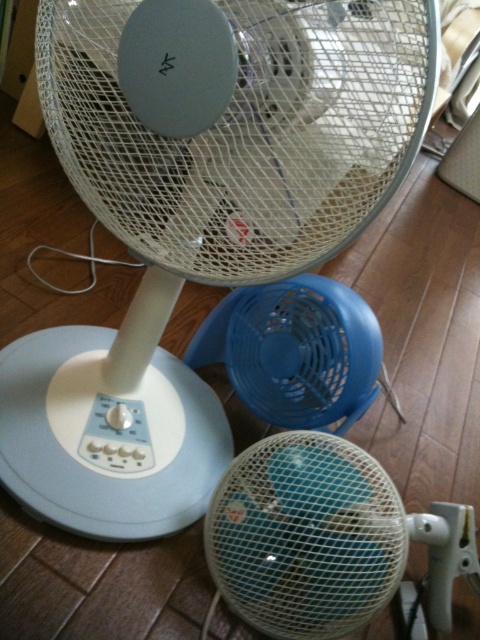
You are standing at the origin point of the coordinate system. You want to move towards the blue mesh fan at center. Which direction should you move in to reach it?

You should move towards the direction of point 0.842 on the x axis and 0.675 on the y axis to reach the blue mesh fan at center.

You are standing in a room with two fans. One is a blue mesh fan at center and the other is a blue plastic fan at center. Which fan is nearer to you?

The blue mesh fan at center is closer to the viewer than the blue plastic fan at center.